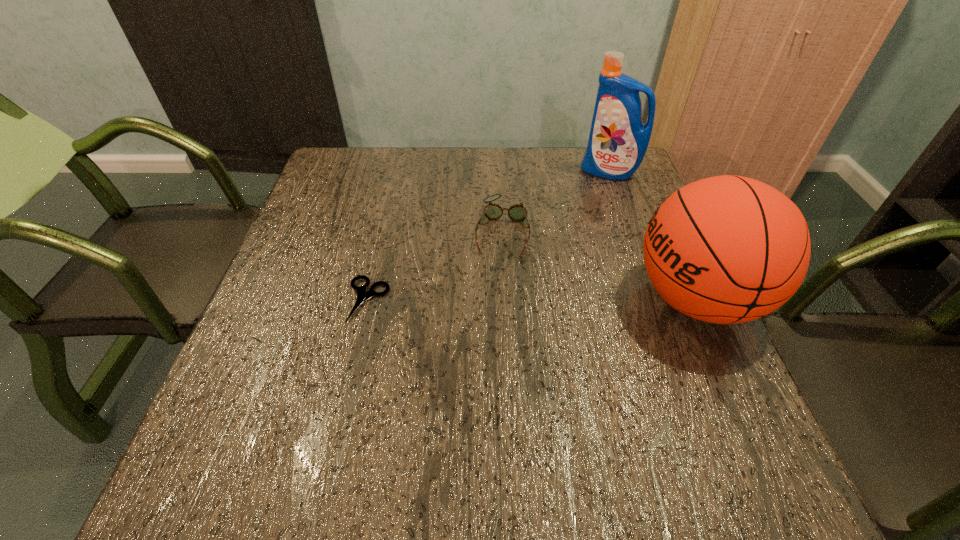
Find the location of a particular element. The width and height of the screenshot is (960, 540). empty location between the third tallest object and the shortest object is located at coordinates (435, 266).

Where is `vacant space that's between the shears and the farthest object`? This screenshot has height=540, width=960. vacant space that's between the shears and the farthest object is located at coordinates (489, 236).

Find the location of `vacant space that is in between the basketball and the shortest object`. vacant space that is in between the basketball and the shortest object is located at coordinates (532, 300).

The width and height of the screenshot is (960, 540). What are the coordinates of `free spot between the shears and the basketball` in the screenshot? It's located at (532, 300).

You are a GUI agent. You are given a task and a screenshot of the screen. Output one action in this format:
    pyautogui.click(x=<x>, y=<y>)
    Task: Click on the vacant point located between the spectacles and the basketball
    The height and width of the screenshot is (540, 960).
    Given the screenshot: What is the action you would take?
    pyautogui.click(x=599, y=265)

Identify the location of free space between the detergent and the shortest object. (489, 236).

Image resolution: width=960 pixels, height=540 pixels. What are the coordinates of `unoccupied position between the third object from right to left and the detergent` in the screenshot? It's located at (556, 201).

Locate an element on the screen. Image resolution: width=960 pixels, height=540 pixels. object that is the second closest to the farthest object is located at coordinates (728, 249).

Select which object appears as the third closest to the detergent. Please provide its 2D coordinates. Your answer should be formatted as a tuple, i.e. [(x, y)], where the tuple contains the x and y coordinates of a point satisfying the conditions above.

[(362, 295)]

You are a GUI agent. You are given a task and a screenshot of the screen. Output one action in this format:
    pyautogui.click(x=<x>, y=<y>)
    Task: Click on the free point that satisfies the following two spatial constraints: 1. on the front side of the basketball; 2. on the side with logo of the third object from right to left
    This screenshot has width=960, height=540.
    Given the screenshot: What is the action you would take?
    506,299